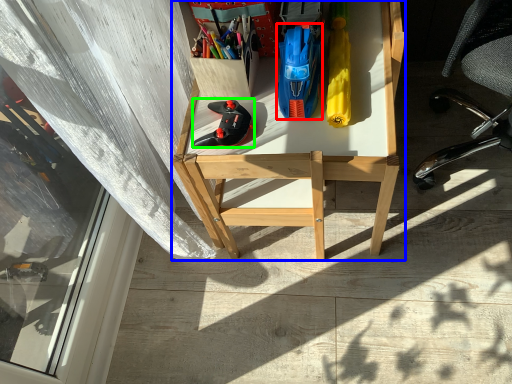
Question: Which is farther away from stationery (highlighted by a red box)? desk (highlighted by a blue box) or footwear (highlighted by a green box)?

Choices:
 (A) desk
 (B) footwear

Answer: (A)